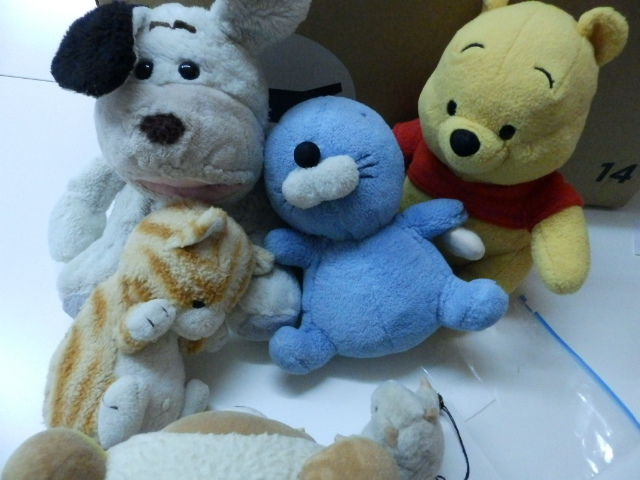
Image resolution: width=640 pixels, height=480 pixels. Identify the location of stuffed animals. (221, 455), (404, 416), (127, 372), (132, 200), (376, 266), (515, 212).